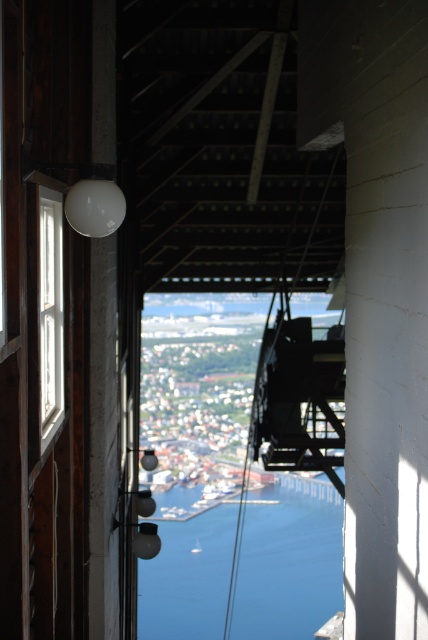
Question: Among these points, which one is farthest from the camera?

Choices:
 (A) (259, 605)
 (B) (199, 548)

Answer: (B)

Question: Observing the image, what is the correct spatial positioning of blue water at center in reference to white plastic boat at center?

Choices:
 (A) above
 (B) below

Answer: (B)

Question: Which of the following is the closest to the observer?

Choices:
 (A) blue water at center
 (B) white plastic boat at center

Answer: (A)

Question: Which of these objects is positioned closest to the white wooden window at left?

Choices:
 (A) white plastic boat at center
 (B) blue water at center

Answer: (B)

Question: Where is blue water at center located in relation to white plastic boat at center in the image?

Choices:
 (A) right
 (B) left

Answer: (A)

Question: In this image, where is blue water at center located relative to white wooden window at left?

Choices:
 (A) left
 (B) right

Answer: (B)